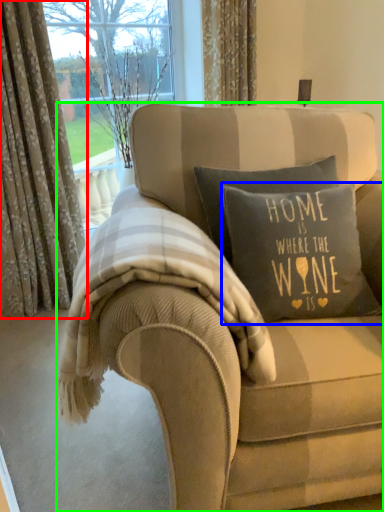
Question: Which object is the closest to the curtain (highlighted by a red box)? Choose among these: pillow (highlighted by a blue box) or studio couch (highlighted by a green box).

Choices:
 (A) pillow
 (B) studio couch

Answer: (A)